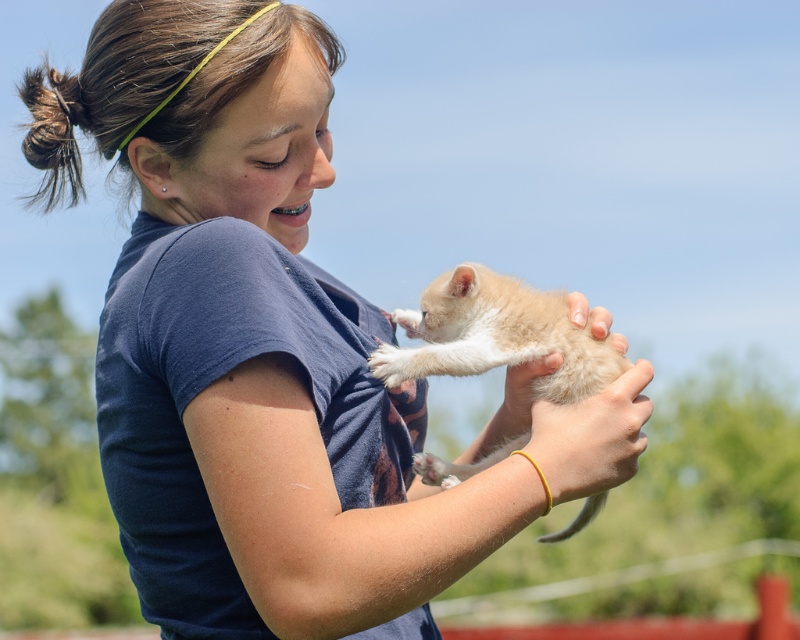
Looking at this image, is smooth skin hand at center bigger than white fluffy paw at upper center?

Yes.

Is smooth skin hand at center above white fluffy paw at upper center?

No.

Who is more forward, (x=558, y=486) or (x=368, y=358)?

Point (x=558, y=486) is in front.

Locate an element on the screen. The width and height of the screenshot is (800, 640). smooth skin hand at center is located at coordinates (590, 435).

Can you confirm if smooth skin hand at center is wider than soft fur paw at center?

Yes.

Find the location of a particular element. This screenshot has width=800, height=640. smooth skin hand at center is located at coordinates (590, 435).

You are a GUI agent. You are given a task and a screenshot of the screen. Output one action in this format:
    pyautogui.click(x=<x>, y=<y>)
    Task: Click on the smooth skin hand at center
    The width and height of the screenshot is (800, 640).
    Given the screenshot: What is the action you would take?
    pyautogui.click(x=590, y=435)

Does soft fur paw at center have a greater width compared to white fluffy paw at upper center?

Yes.

Between soft fur paw at center and white fluffy paw at upper center, which one has less height?

white fluffy paw at upper center

Who is more forward, (492, 419) or (394, 352)?

Positioned in front is point (394, 352).

Image resolution: width=800 pixels, height=640 pixels. I want to click on soft fur paw at center, so click(x=520, y=394).